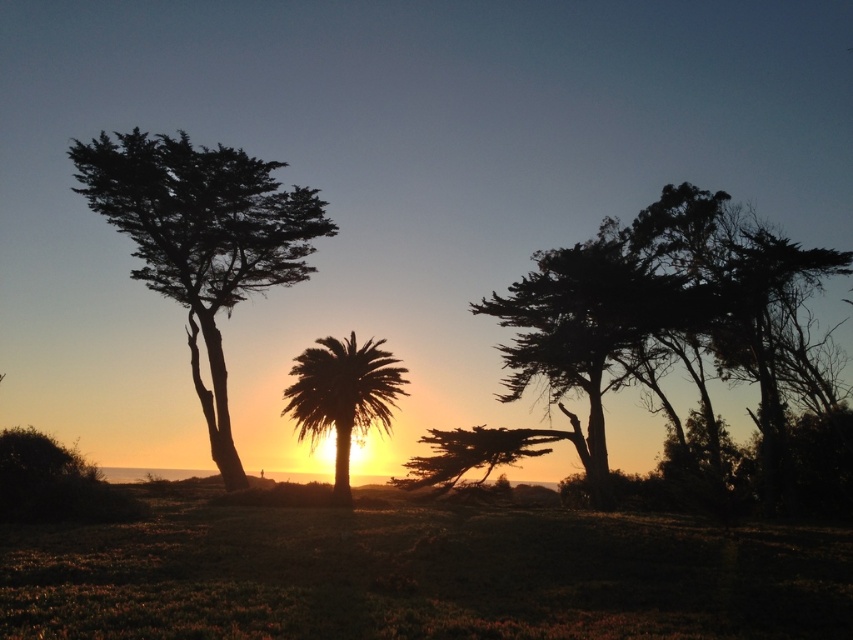
You are an artist planning to paint the sunset scene. You want to ensure the silhouette wood tree at right and silhouette palm tree at center are proportionally accurate. Which tree should you make wider in your painting?

The silhouette wood tree at right should be made wider in the painting since it might be wider than the silhouette palm tree at center according to the description.

You are standing in the grassy field looking at the sunset scene. There are two points marked in the image. One is at coordinate point [508,397] and the other at point [198,380]. Which point is closer to your eyes?

Point [198,380] is closer to your eyes because it is less further to the camera than point [508,397].

You are standing in the middle of the green grassy at lower center and want to walk to the silhouette wood tree at right. Which direction should you walk to reach the tree?

You should walk to the right because the silhouette wood tree at right is located to the right side of the green grassy at lower center.